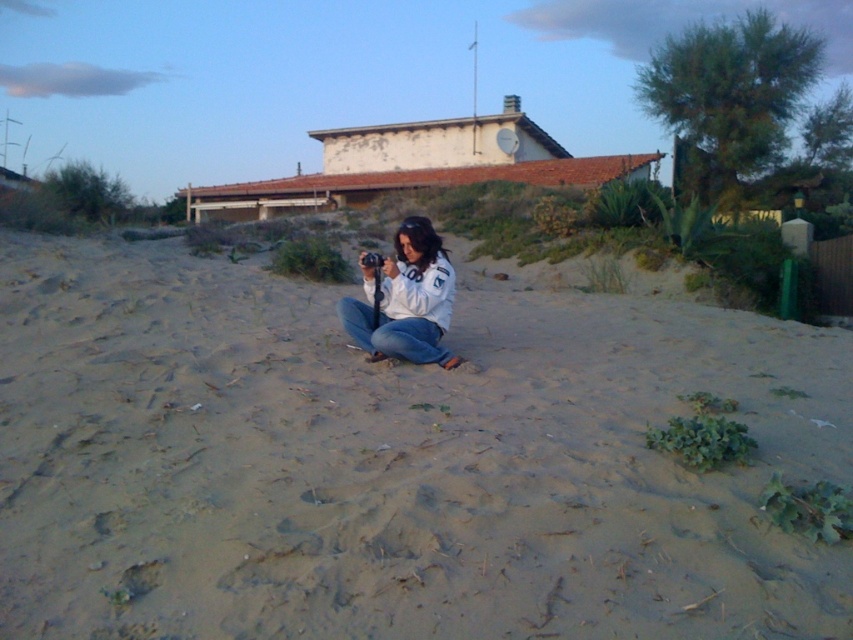
Who is more forward, (254, 481) or (373, 355)?

Point (254, 481) is in front.

Can you confirm if sandy beige sand at center is shorter than white matte jacket at center?

In fact, sandy beige sand at center may be taller than white matte jacket at center.

Describe the element at coordinates (392, 461) in the screenshot. I see `sandy beige sand at center` at that location.

I want to click on sandy beige sand at center, so click(392, 461).